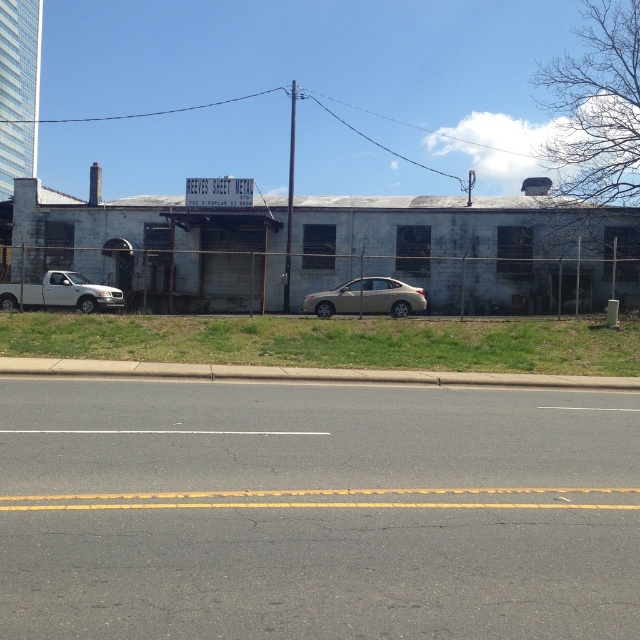
Question: Can you confirm if satin silver sedan at center is wider than white matte truck at left?

Choices:
 (A) yes
 (B) no

Answer: (A)

Question: Which of the following is the closest to the observer?

Choices:
 (A) satin silver sedan at center
 (B) green grass at lower center

Answer: (B)

Question: Is green grass at lower center to the left of satin silver sedan at center from the viewer's perspective?

Choices:
 (A) yes
 (B) no

Answer: (A)

Question: Can you confirm if satin silver sedan at center is positioned below white matte truck at left?

Choices:
 (A) no
 (B) yes

Answer: (B)

Question: Which point is farther to the camera?

Choices:
 (A) (4, 308)
 (B) (328, 296)

Answer: (B)

Question: Which of the following is the farthest from the observer?

Choices:
 (A) (128, 337)
 (B) (58, 305)
 (C) (381, 282)

Answer: (B)